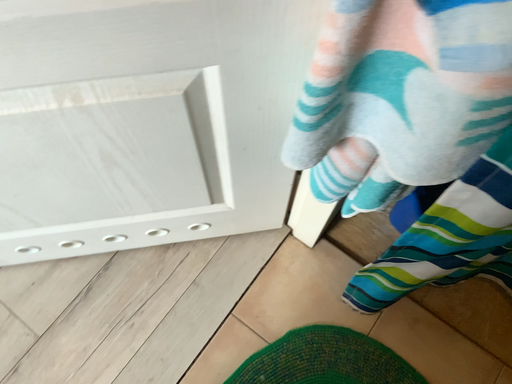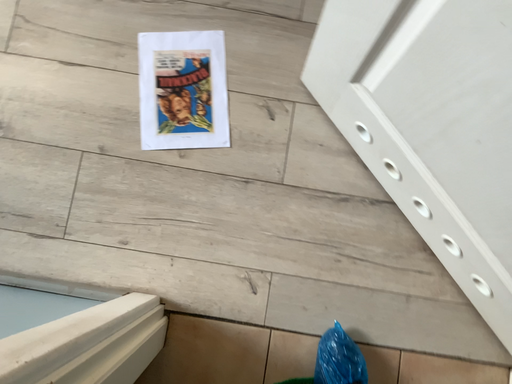
Question: Which way did the camera rotate in the video?

Choices:
 (A) rotated left
 (B) rotated right

Answer: (A)